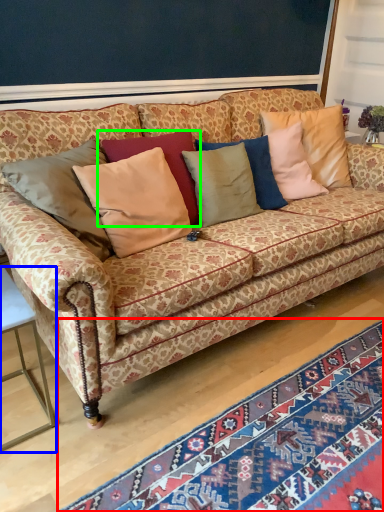
Question: Which object is positioned closest to mat (highlighted by a red box)? Select from table (highlighted by a blue box) and pillow (highlighted by a green box).

Choices:
 (A) table
 (B) pillow

Answer: (A)